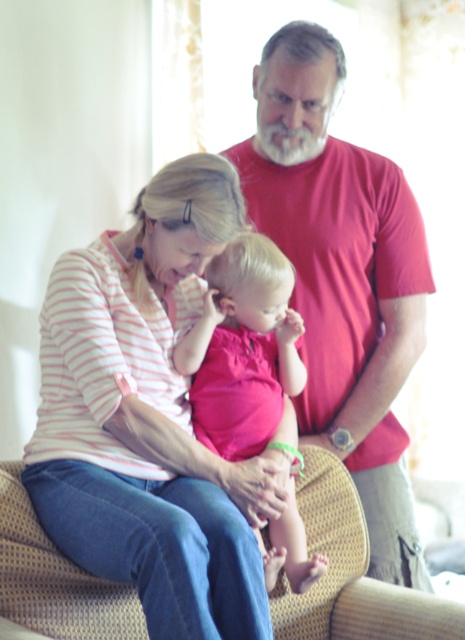
Is point (389, 365) closer to camera compared to point (253, 381)?

No, (389, 365) is behind (253, 381).

Where is `smooth red shirt at center`? smooth red shirt at center is located at coordinates (343, 278).

Image resolution: width=465 pixels, height=640 pixels. In order to click on smooth red shirt at center in this screenshot , I will do `click(343, 278)`.

Does pink striped shirt at center have a lesser height compared to smooth red shirt at center?

Yes.

Can you confirm if pink striped shirt at center is taller than smooth red shirt at center?

No, pink striped shirt at center is not taller than smooth red shirt at center.

The image size is (465, 640). What do you see at coordinates (146, 419) in the screenshot?
I see `pink striped shirt at center` at bounding box center [146, 419].

Locate an element on the screen. The width and height of the screenshot is (465, 640). pink striped shirt at center is located at coordinates (146, 419).

Does pink striped shirt at center appear under pink fabric baby at center?

No, pink striped shirt at center is not below pink fabric baby at center.

This screenshot has height=640, width=465. Identify the location of pink striped shirt at center. (146, 419).

Locate an element on the screen. The width and height of the screenshot is (465, 640). pink striped shirt at center is located at coordinates (146, 419).

Find the location of `pink striped shirt at center`. pink striped shirt at center is located at coordinates (146, 419).